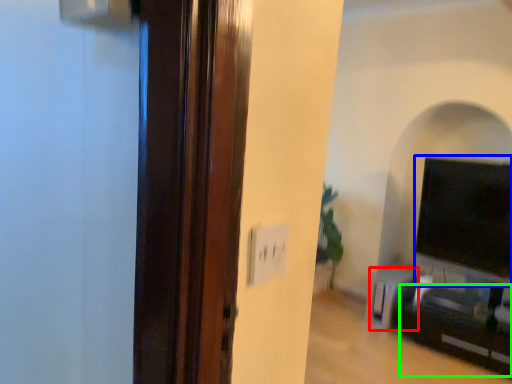
Question: Which object is positioned closest to furniture (highlighted by a red box)? Select from wide (highlighted by a blue box) and entertainment center (highlighted by a green box).

Choices:
 (A) wide
 (B) entertainment center

Answer: (B)